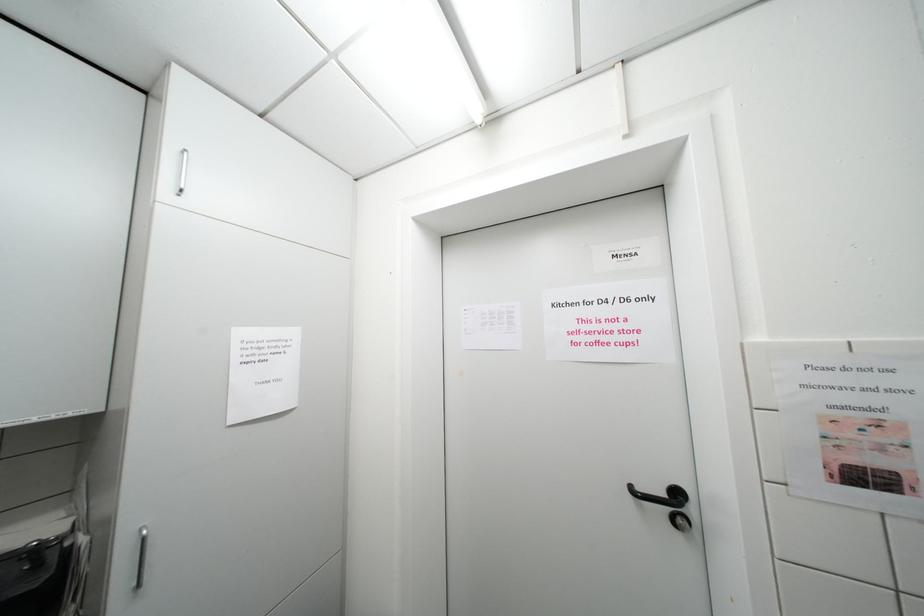
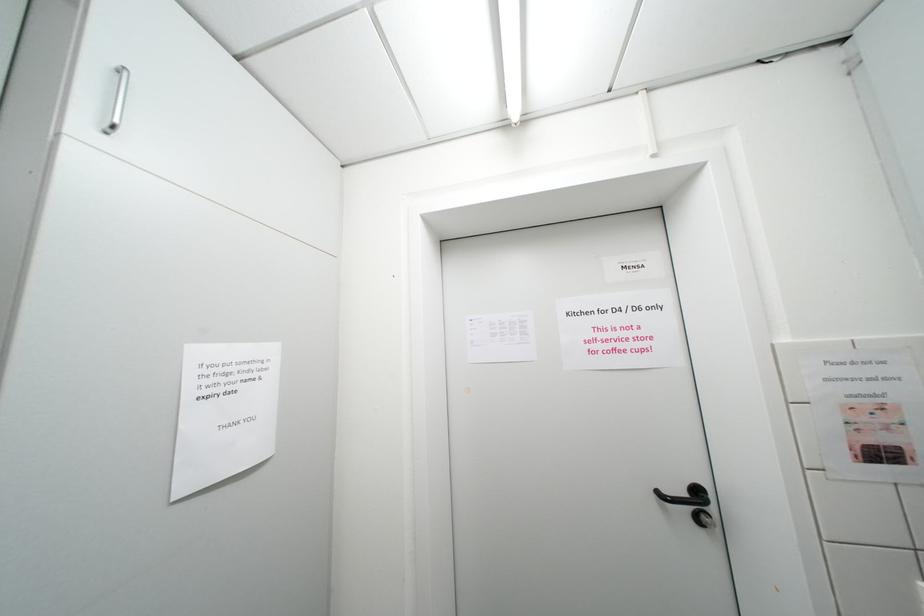
What movement of the cameraman would produce the second image?

The cameraman walked toward left, forward.